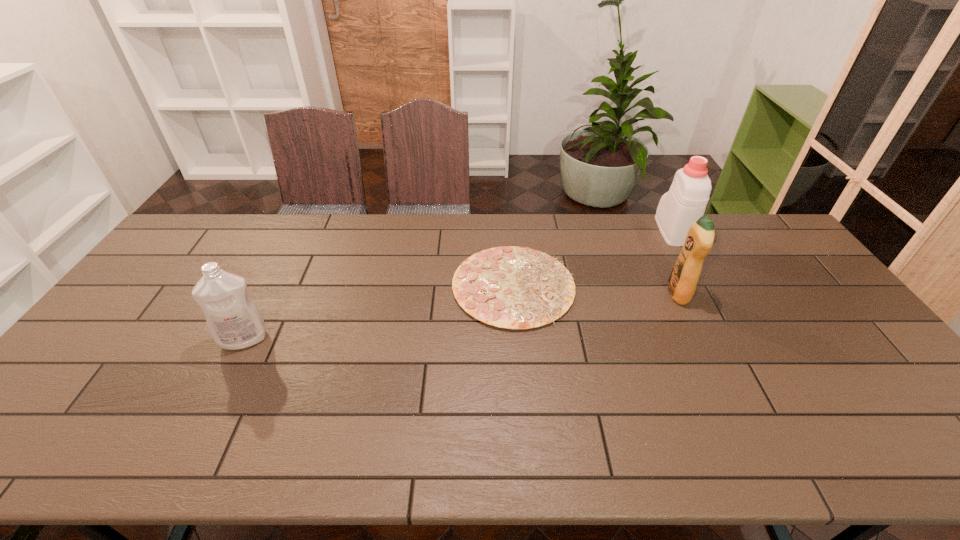
This screenshot has height=540, width=960. What are the coordinates of `the rightmost object` in the screenshot? It's located at (685, 202).

What are the coordinates of `the farthest object` in the screenshot? It's located at (685, 202).

Identify the location of the second nearest detergent. This screenshot has width=960, height=540. (683, 279).

The width and height of the screenshot is (960, 540). Identify the location of the second detergent from right to left. (683, 279).

Identify the location of the leftmost object. (234, 321).

What are the coordinates of `the nearest detergent` in the screenshot? It's located at (234, 321).

Find the location of a particular element. The width and height of the screenshot is (960, 540). the second object from left to right is located at coordinates (511, 287).

I want to click on pizza, so click(x=511, y=287).

You are a GUI agent. You are given a task and a screenshot of the screen. Output one action in this format:
    pyautogui.click(x=<x>, y=<y>)
    Task: Click on the free location located on the label of the second object from right to left
    The image size is (960, 540).
    Given the screenshot: What is the action you would take?
    pyautogui.click(x=558, y=294)

Where is `free space located on the label of the second object from right to left`? This screenshot has height=540, width=960. free space located on the label of the second object from right to left is located at coordinates (568, 294).